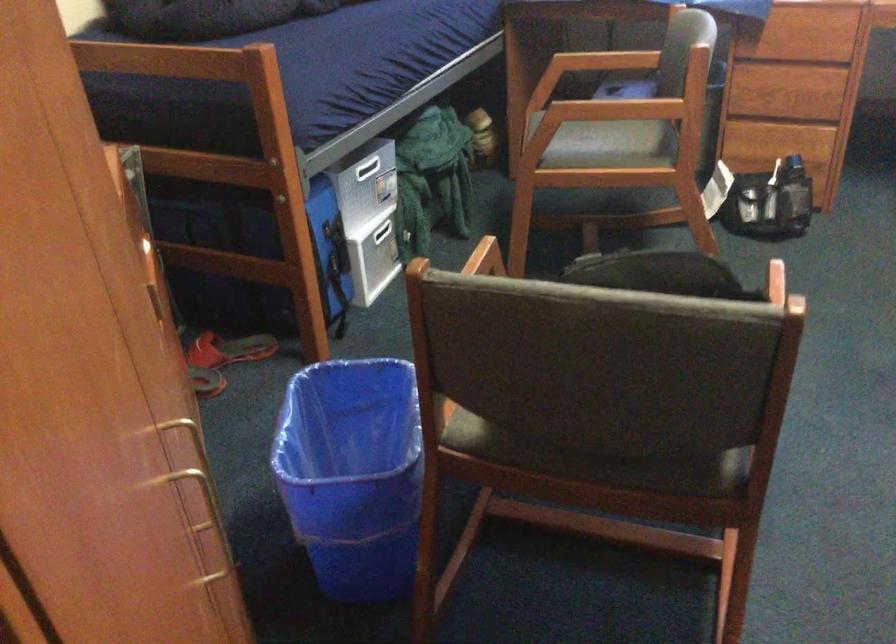
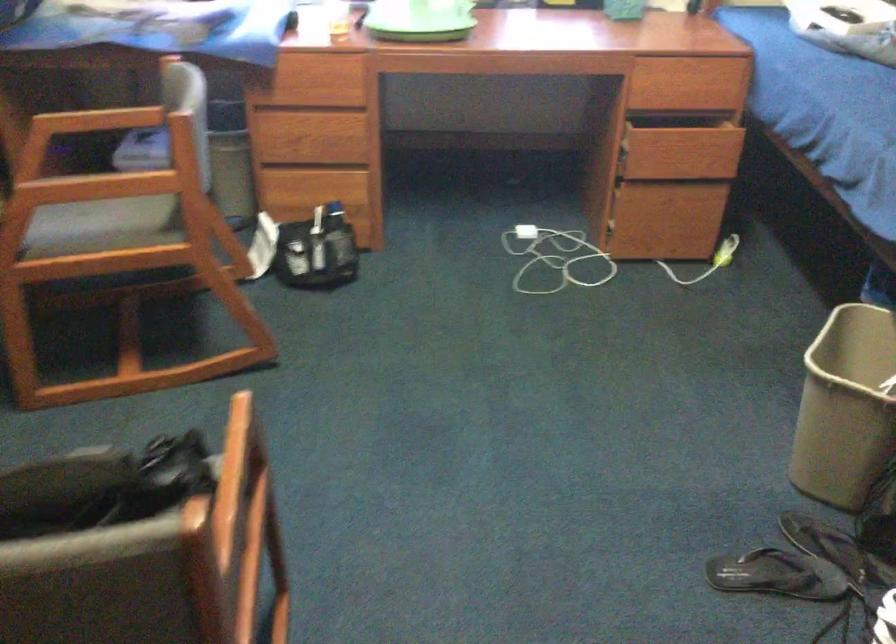
What movement of the cameraman would produce the second image?

The cameraman walked toward right, forward.